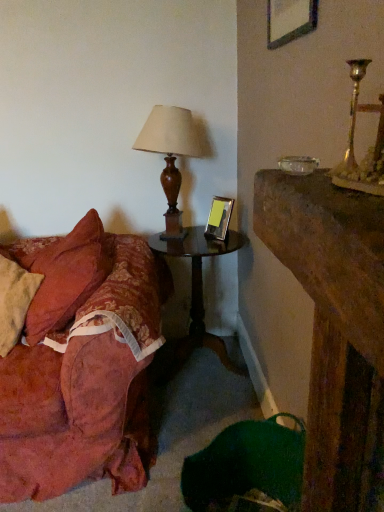
Question: From the image's perspective, is metallic silver picture frame at center, acting as the 2th picture frame starting from the right, located above wooden dark brown side table at center?

Choices:
 (A) yes
 (B) no

Answer: (A)

Question: Is metallic silver picture frame at center, which is the first picture frame from left to right, facing towards wooden dark brown side table at center?

Choices:
 (A) yes
 (B) no

Answer: (B)

Question: Is metallic silver picture frame at center, which is the 2th picture frame from top to bottom, touching wooden dark brown side table at center?

Choices:
 (A) yes
 (B) no

Answer: (B)

Question: Is wooden dark brown side table at center a part of metallic silver picture frame at center, the 2th picture frame from the front?

Choices:
 (A) no
 (B) yes

Answer: (A)

Question: Does metallic silver picture frame at center, which is the first picture frame from left to right, have a greater height compared to wooden dark brown side table at center?

Choices:
 (A) no
 (B) yes

Answer: (A)

Question: Does point (339, 170) appear closer or farther from the camera than point (200, 260)?

Choices:
 (A) closer
 (B) farther

Answer: (A)

Question: In terms of height, does gold metallic candle holder at upper right look taller or shorter compared to wooden dark brown side table at center?

Choices:
 (A) short
 (B) tall

Answer: (A)

Question: From a real-world perspective, is gold metallic candle holder at upper right physically located above or below wooden dark brown side table at center?

Choices:
 (A) below
 (B) above

Answer: (B)

Question: Is gold metallic candle holder at upper right inside the boundaries of wooden dark brown side table at center, or outside?

Choices:
 (A) outside
 (B) inside

Answer: (A)

Question: Would you say wooden lampshade at left is to the left or to the right of wooden dark brown side table at center in the picture?

Choices:
 (A) right
 (B) left

Answer: (B)

Question: From a real-world perspective, relative to wooden dark brown side table at center, is wooden lampshade at left vertically above or below?

Choices:
 (A) below
 (B) above

Answer: (B)

Question: Is point (175, 168) positioned closer to the camera than point (200, 290)?

Choices:
 (A) farther
 (B) closer

Answer: (B)

Question: Is wooden lampshade at left inside the boundaries of wooden dark brown side table at center, or outside?

Choices:
 (A) outside
 (B) inside

Answer: (A)

Question: From the image's perspective, is wooden picture frame at upper center, the first picture frame from the top, located above or below metallic silver picture frame at center, which is the first picture frame from left to right?

Choices:
 (A) above
 (B) below

Answer: (A)

Question: Is point (x=311, y=14) closer or farther from the camera than point (x=211, y=200)?

Choices:
 (A) closer
 (B) farther

Answer: (A)